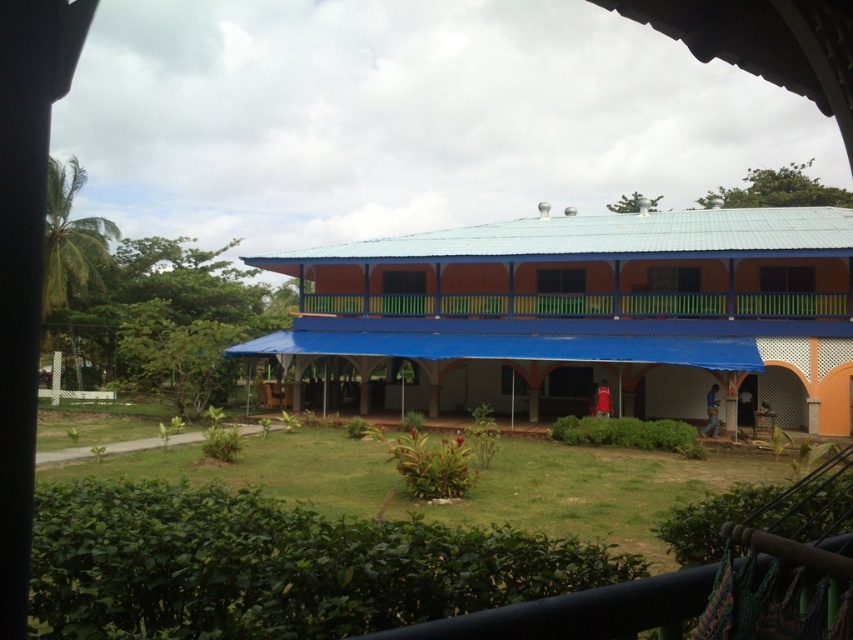
You are a delivery person with a cart that is 2 meters wide. You need to deliver a package to the building. The path between the blue fabric canopy at center and the green painted wood balcony at center is your only route. Can your cart fit through the space between them?

The blue fabric canopy at center and green painted wood balcony at center are 2.54 meters apart. Since your cart is 2 meters wide, it can fit through the space between them because 2.54 meters is wider than 2 meters.

You are standing at the entrance of the building and want to find shade from the sun. Which object provides more coverage? The blue fabric canopy at center or the green painted wood balcony at center?

The blue fabric canopy at center is positioned over the green painted wood balcony at center, so it provides more coverage for shade.